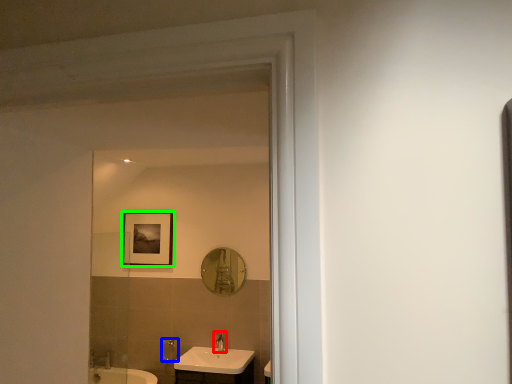
Question: Based on their relative distances, which object is farther from tap (highlighted by a red box)? Choose from shower (highlighted by a blue box) and picture frame (highlighted by a green box).

Choices:
 (A) shower
 (B) picture frame

Answer: (B)